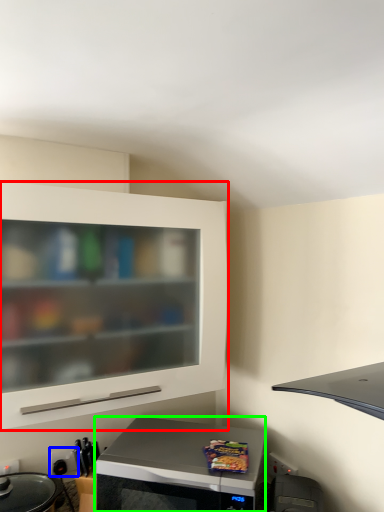
Question: Which object is positioned closest to cabinetry (highlighted by a red box)? Select from electric outlet (highlighted by a blue box) and microwave oven (highlighted by a green box).

Choices:
 (A) electric outlet
 (B) microwave oven

Answer: (B)